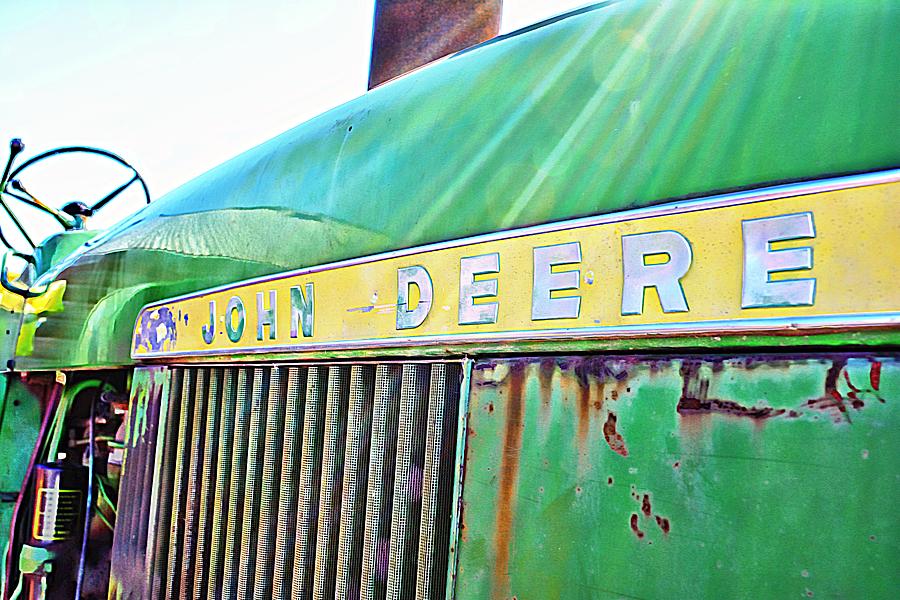
I want to click on radiator, so click(285, 455).